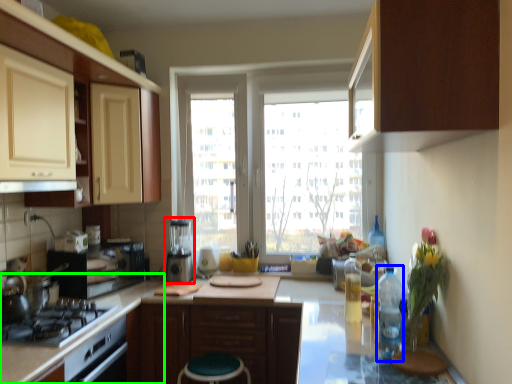
Question: Estimate the real-world distances between objects in this image. Which object is closer to appliance (highlighted by a red box), bottle (highlighted by a blue box) or counter top (highlighted by a green box)?

Choices:
 (A) bottle
 (B) counter top

Answer: (B)